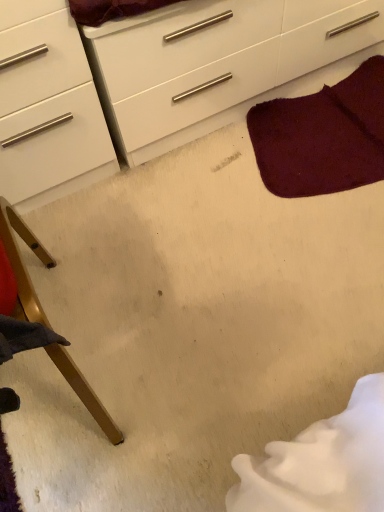
Question: Based on their positions, is white glossy chest of drawers at upper center located to the left or right of burgundy plush rug at upper right?

Choices:
 (A) left
 (B) right

Answer: (A)

Question: From the image's perspective, is white glossy chest of drawers at upper center located above or below burgundy plush rug at upper right?

Choices:
 (A) above
 (B) below

Answer: (A)

Question: Which is nearer to the burgundy plush rug at upper right?

Choices:
 (A) white glossy chest of drawers at upper center
 (B) wooden chair leg at lower left

Answer: (A)

Question: Estimate the real-world distances between objects in this image. Which object is closer to the wooden chair leg at lower left?

Choices:
 (A) burgundy plush rug at upper right
 (B) white glossy chest of drawers at upper center

Answer: (B)